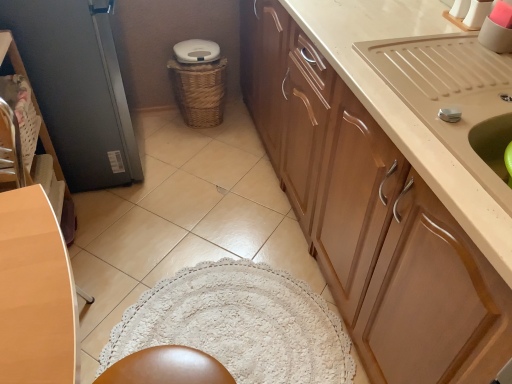
Question: Is matte brown chair at left completely or partially inside metallic gray screen door at left?

Choices:
 (A) yes
 (B) no

Answer: (B)

Question: Can you see metallic gray screen door at left touching matte brown chair at left?

Choices:
 (A) yes
 (B) no

Answer: (B)

Question: From a real-world perspective, is metallic gray screen door at left below matte brown chair at left?

Choices:
 (A) no
 (B) yes

Answer: (A)

Question: Considering the relative sizes of metallic gray screen door at left and matte brown chair at left in the image provided, is metallic gray screen door at left shorter than matte brown chair at left?

Choices:
 (A) yes
 (B) no

Answer: (A)

Question: Is metallic gray screen door at left facing away from matte brown chair at left?

Choices:
 (A) yes
 (B) no

Answer: (B)

Question: Is metallic gray screen door at left to the left of matte brown chair at left from the viewer's perspective?

Choices:
 (A) yes
 (B) no

Answer: (A)

Question: Is wooden cabinet at upper right facing away from metallic gray screen door at left?

Choices:
 (A) no
 (B) yes

Answer: (A)

Question: Does wooden cabinet at upper right have a smaller size compared to metallic gray screen door at left?

Choices:
 (A) no
 (B) yes

Answer: (A)

Question: Can you confirm if wooden cabinet at upper right is taller than metallic gray screen door at left?

Choices:
 (A) yes
 (B) no

Answer: (A)

Question: Is the depth of wooden cabinet at upper right greater than that of metallic gray screen door at left?

Choices:
 (A) yes
 (B) no

Answer: (B)

Question: Does wooden cabinet at upper right turn towards metallic gray screen door at left?

Choices:
 (A) yes
 (B) no

Answer: (A)

Question: From the image's perspective, is wooden cabinet at upper right located above metallic gray screen door at left?

Choices:
 (A) no
 (B) yes

Answer: (A)

Question: Can you confirm if beige glossy sink at upper right is positioned to the left of metallic gray screen door at left?

Choices:
 (A) no
 (B) yes

Answer: (A)